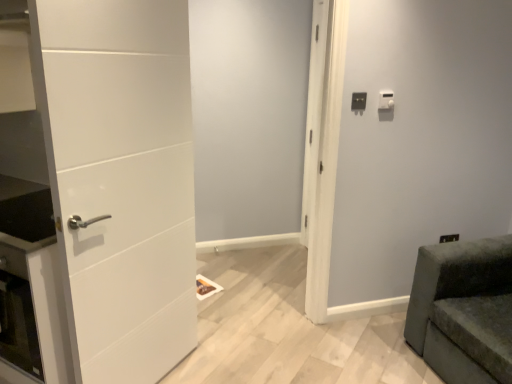
Locate an element on the screen. This screenshot has width=512, height=384. free point below white matte door at center (from a real-world perspective) is located at coordinates (258, 329).